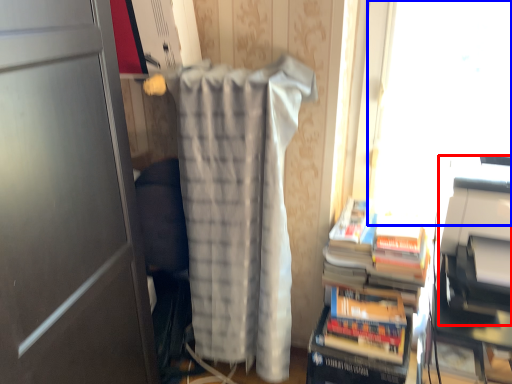
Question: Among these objects, which one is farthest to the camera, printer (highlighted by a red box) or window screen (highlighted by a blue box)?

Choices:
 (A) printer
 (B) window screen

Answer: (B)